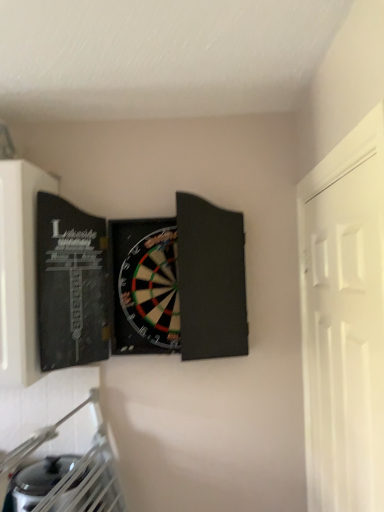
You are a GUI agent. You are given a task and a screenshot of the screen. Output one action in this format:
    pyautogui.click(x=<x>, y=<y>)
    Task: Click on the black matte dartboard at center
    
    Given the screenshot: What is the action you would take?
    pyautogui.click(x=140, y=283)

What do you see at coordinates (140, 283) in the screenshot? The width and height of the screenshot is (384, 512). I see `black matte dartboard at center` at bounding box center [140, 283].

From the picture: Measure the distance between point (56, 205) and camera.

The distance of point (56, 205) from camera is 1.45 meters.

This screenshot has height=512, width=384. Describe the element at coordinates (344, 338) in the screenshot. I see `white matte door at right` at that location.

Where is `white matte door at right`? white matte door at right is located at coordinates (344, 338).

In order to click on black matte dartboard at center in this screenshot , I will do `click(140, 283)`.

Considering the positions of objects black matte dartboard at center and white matte door at right in the image provided, who is more to the left, black matte dartboard at center or white matte door at right?

Positioned to the left is black matte dartboard at center.

Which object is more forward, black matte dartboard at center or white matte door at right?

Positioned in front is white matte door at right.

Which point is more forward, (x=240, y=280) or (x=371, y=239)?

Positioned in front is point (x=371, y=239).

From the image's perspective, is black matte dartboard at center on white matte door at right?

Correct, black matte dartboard at center appears higher than white matte door at right in the image.

From a real-world perspective, who is located higher, black matte dartboard at center or white matte door at right?

In real-world perspective, black matte dartboard at center is above.

Which of these two, black matte dartboard at center or white matte door at right, is wider?

black matte dartboard at center.

Can you confirm if black matte dartboard at center is shorter than white matte door at right?

Indeed, black matte dartboard at center has a lesser height compared to white matte door at right.

Considering the sizes of objects black matte dartboard at center and white matte door at right in the image provided, who is smaller, black matte dartboard at center or white matte door at right?

Smaller between the two is white matte door at right.

From the picture: Does black matte dartboard at center contain white matte door at right?

No.

Is black matte dartboard at center directly adjacent to white matte door at right?

No, black matte dartboard at center is not with white matte door at right.

Does black matte dartboard at center turn towards white matte door at right?

No.

What's the angular difference between black matte dartboard at center and white matte door at right's facing directions?

The angular difference between black matte dartboard at center and white matte door at right is 88.7 degrees.

The width and height of the screenshot is (384, 512). What are the coordinates of `book behind the white matte door at right` in the screenshot? It's located at (140, 283).

Does white matte door at right appear on the left side of black matte dartboard at center?

Incorrect, white matte door at right is not on the left side of black matte dartboard at center.

Is white matte door at right positioned in front of black matte dartboard at center?

Yes, the depth of white matte door at right is less than that of black matte dartboard at center.

Does point (317, 300) lie behind point (225, 291)?

No, (317, 300) is in front of (225, 291).

From the image's perspective, who appears lower, white matte door at right or black matte dartboard at center?

white matte door at right appears lower in the image.

From the picture: From a real-world perspective, is white matte door at right positioned above or below black matte dartboard at center?

white matte door at right is below black matte dartboard at center.

Which object is wider, white matte door at right or black matte dartboard at center?

black matte dartboard at center is wider.

Does white matte door at right have a greater height compared to black matte dartboard at center?

Yes.

Looking at the image, does white matte door at right seem bigger or smaller compared to black matte dartboard at center?

Considering their sizes, white matte door at right takes up less space than black matte dartboard at center.

Is white matte door at right completely or partially outside of black matte dartboard at center?

Yes, white matte door at right is outside of black matte dartboard at center.

Are white matte door at right and black matte dartboard at center making contact?

No, white matte door at right is not in contact with black matte dartboard at center.

Is white matte door at right aimed at black matte dartboard at center?

Yes.

You are a GUI agent. You are given a task and a screenshot of the screen. Output one action in this format:
    pyautogui.click(x=<x>, y=<y>)
    Task: Click on the door below the black matte dartboard at center (from a real-world perspective)
    
    Given the screenshot: What is the action you would take?
    [x=344, y=338]

You are a GUI agent. You are given a task and a screenshot of the screen. Output one action in this format:
    pyautogui.click(x=<x>, y=<y>)
    Task: Click on the door in front of the black matte dartboard at center
    
    Given the screenshot: What is the action you would take?
    pyautogui.click(x=344, y=338)

Where is `book above the white matte door at right (from the image's perspective)`? The height and width of the screenshot is (512, 384). book above the white matte door at right (from the image's perspective) is located at coordinates (140, 283).